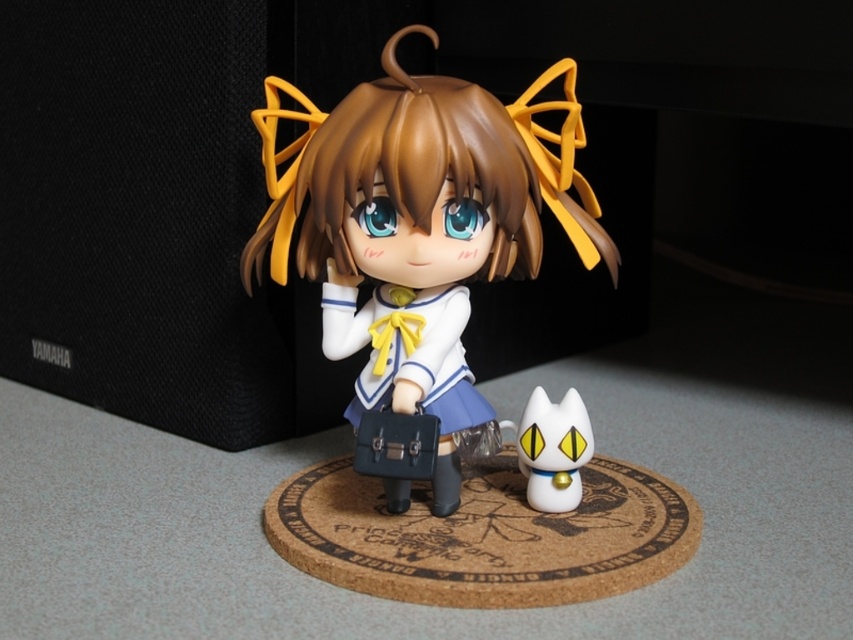
Where is the satin white doll at center located in the image?

The satin white doll at center is located at point (421,230).

Based on the scene description, if you are looking at the image and want to place a new object between the satin white doll at center and the white glossy cat at lower right, where should you position it?

The new object should be placed between the satin white doll at center and the white glossy cat at lower right, positioned to the right of the satin white doll at center and to the left of the white glossy cat at lower right since the satin white doll at center is to the left of the white glossy cat at lower right.

You are a collector who wants to place both the satin white doll at center and the white glossy cat at lower right on a shelf. You need to know their positions relative to each other. Which object is closer to the front of the shelf?

The satin white doll at center is closer to the front of the shelf because it is positioned in front of the white glossy cat at lower right.